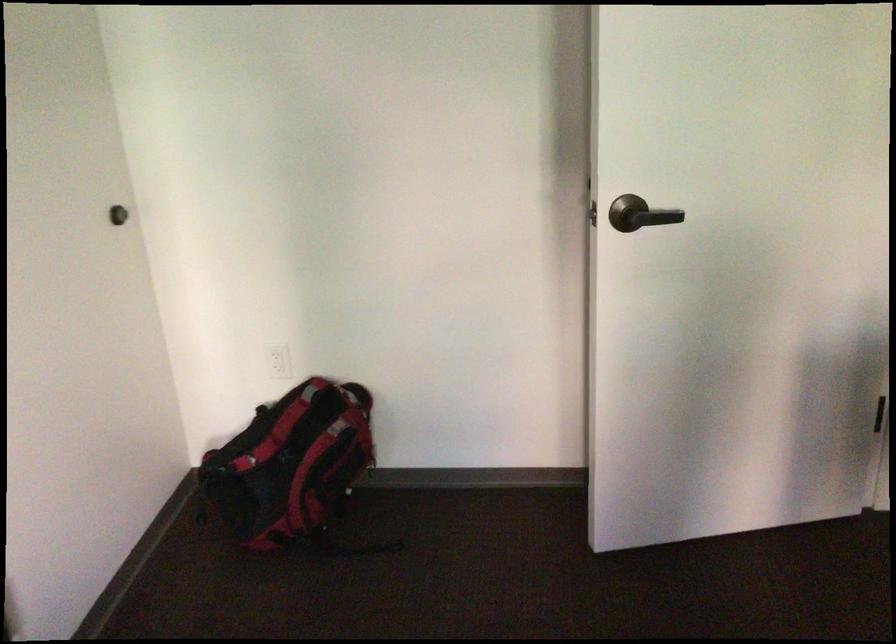
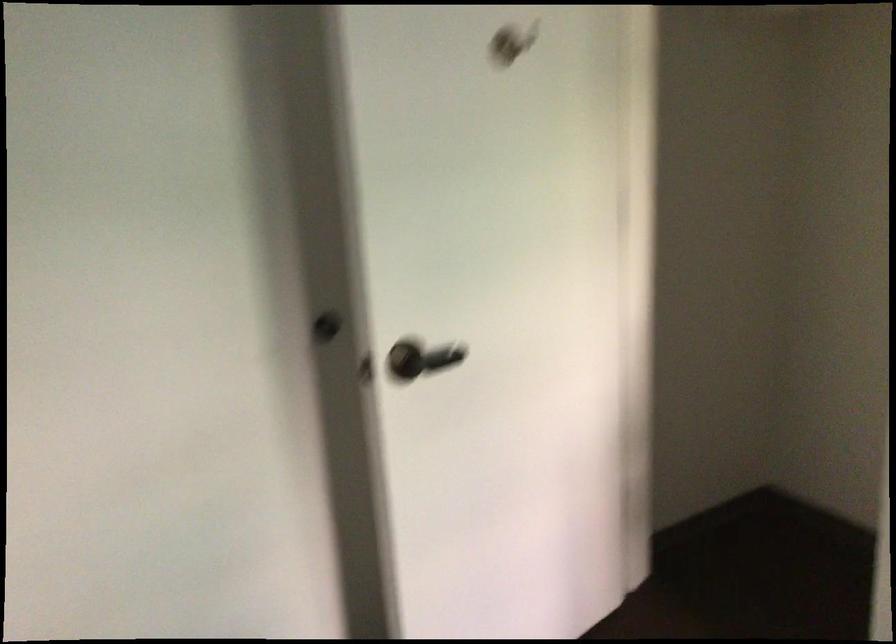
In the second image, find the point that corresponds to point 625,207 in the first image.

(407, 359)